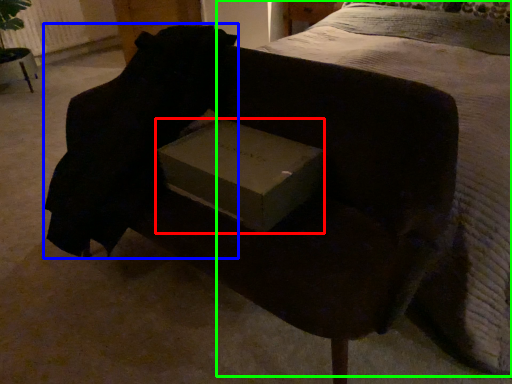
Question: Which is nearer to the box (highlighted by a red box)? back (highlighted by a blue box) or bed (highlighted by a green box).

Choices:
 (A) back
 (B) bed

Answer: (A)